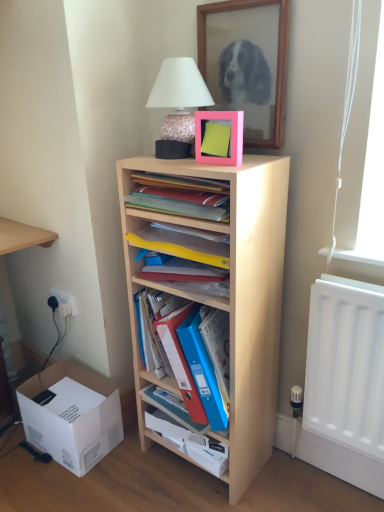
Find the location of a particular element. Image resolution: width=384 pixels, height=512 pixels. empty space that is to the right of pink matte picture frame at upper center is located at coordinates (264, 157).